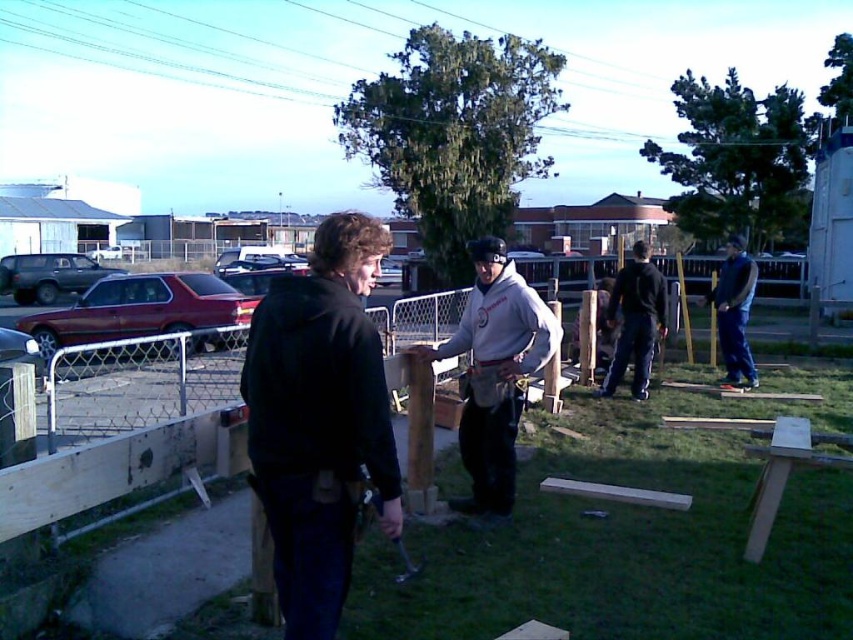
Question: Is black matte jacket at center thinner than blue jeans at right?

Choices:
 (A) no
 (B) yes

Answer: (B)

Question: Can you confirm if black matte jacket at center is smaller than blue jeans at right?

Choices:
 (A) yes
 (B) no

Answer: (A)

Question: Which of the following is the closest to the observer?

Choices:
 (A) (532, 312)
 (B) (352, 528)
 (C) (633, 300)
 (D) (721, 296)

Answer: (B)

Question: Which of the following is the closest to the observer?

Choices:
 (A) (663, 300)
 (B) (751, 276)
 (C) (352, 492)

Answer: (C)

Question: Among these points, which one is nearest to the camera?

Choices:
 (A) coord(784,432)
 (B) coord(479,474)
 (C) coord(722,316)
 (D) coord(625,289)

Answer: (A)

Question: Is the position of black matte jacket at center less distant than that of blue jeans at right?

Choices:
 (A) yes
 (B) no

Answer: (A)